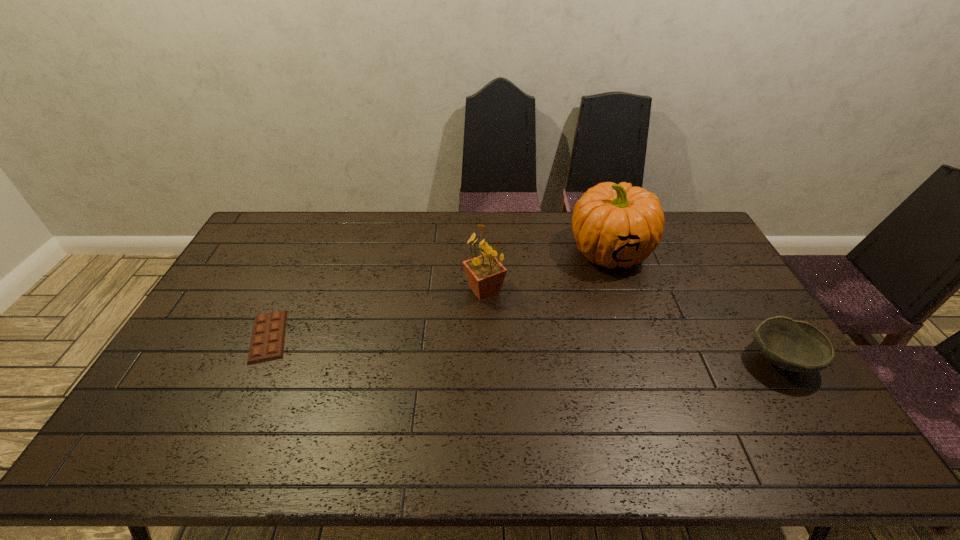
You are a GUI agent. You are given a task and a screenshot of the screen. Output one action in this format:
    pyautogui.click(x=<x>, y=<y>)
    Task: Click on the free space between the third tallest object and the leftmost object
    The height and width of the screenshot is (540, 960).
    Given the screenshot: What is the action you would take?
    pyautogui.click(x=524, y=348)

At what (x,y) coordinates should I click in order to perform the action: click on vacant space in between the third object from left to right and the second shortest object. Please return your answer as a coordinate pair (x, y). This screenshot has height=540, width=960. Looking at the image, I should click on (695, 306).

Locate which object is the second closest to the third object from left to right. Please provide its 2D coordinates. Your answer should be formatted as a tuple, i.e. [(x, y)], where the tuple contains the x and y coordinates of a point satisfying the conditions above.

[(792, 345)]

The height and width of the screenshot is (540, 960). I want to click on object that is the second closest to the third object from left to right, so click(792, 345).

Identify the location of vacant position in the image that satisfies the following two spatial constraints: 1. on the back side of the third object from left to right; 2. on the right side of the second object from left to right. This screenshot has width=960, height=540. click(x=484, y=251).

Identify the location of vacant region that satisfies the following two spatial constraints: 1. on the back side of the shortest object; 2. on the right side of the second object from left to right. This screenshot has width=960, height=540. [x=290, y=291].

At what (x,y) coordinates should I click in order to perform the action: click on free space in the image that satisfies the following two spatial constraints: 1. on the front side of the rightmost object; 2. on the right side of the pumpkin. Please return your answer as a coordinate pair (x, y). The image size is (960, 540). Looking at the image, I should click on (648, 360).

Locate an element on the screen. This screenshot has height=540, width=960. vacant space that satisfies the following two spatial constraints: 1. on the back side of the pumpkin; 2. on the left side of the second object from left to right is located at coordinates (484, 251).

I want to click on blank space that satisfies the following two spatial constraints: 1. on the front side of the sunflower; 2. on the left side of the second shortest object, so click(485, 360).

The image size is (960, 540). I want to click on free region that satisfies the following two spatial constraints: 1. on the front side of the bowl; 2. on the left side of the sunflower, so click(485, 360).